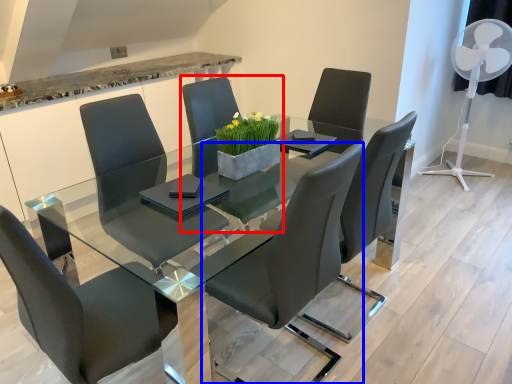
Question: Which object appears closest to the camera in this image, chair (highlighted by a red box) or chair (highlighted by a blue box)?

Choices:
 (A) chair
 (B) chair

Answer: (B)